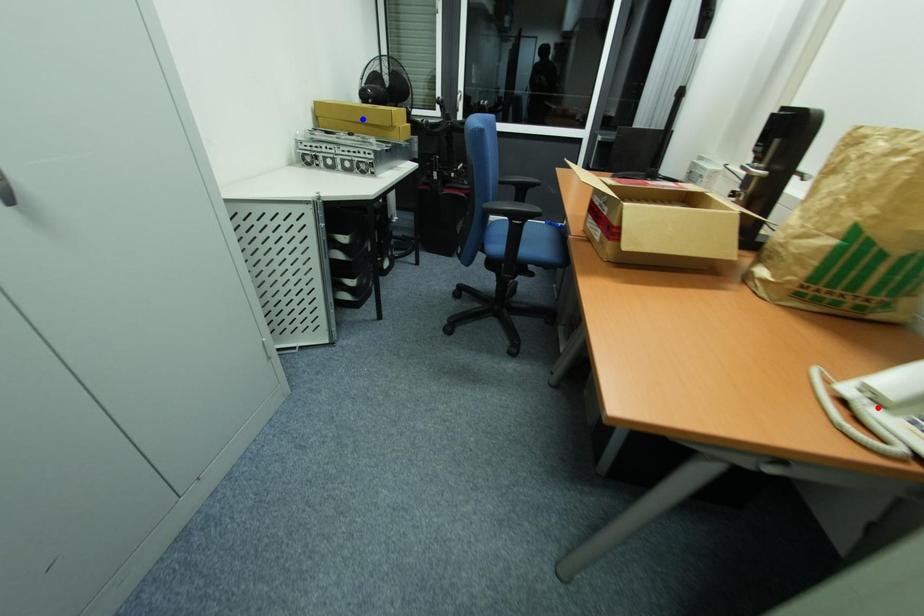
Question: Two points are marked on the image. Which point is closer to the camera?

Choices:
 (A) Blue point is closer.
 (B) Red point is closer.

Answer: (B)